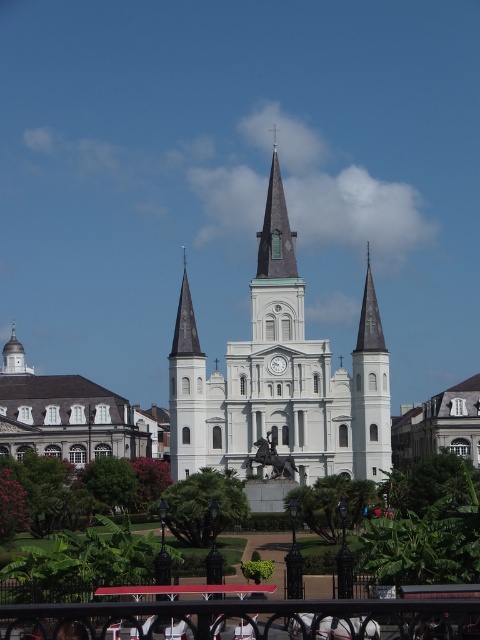
Question: Is white stone clock tower at center below dark gray stone spire at center?

Choices:
 (A) yes
 (B) no

Answer: (A)

Question: Can you confirm if dark gray stone spire at center is thinner than white glossy clock at center?

Choices:
 (A) no
 (B) yes

Answer: (A)

Question: Which point is closer to the camera?

Choices:
 (A) (267, 193)
 (B) (272, 365)

Answer: (B)

Question: Is white stone church at center to the right of dark gray stone spire at center from the viewer's perspective?

Choices:
 (A) yes
 (B) no

Answer: (B)

Question: Which point is closer to the camera?

Choices:
 (A) white stone church at center
 (B) dark gray stone spire at center
 (C) white glossy clock at center

Answer: (C)

Question: Which point is closer to the camera taking this photo?

Choices:
 (A) (268, 234)
 (B) (278, 358)
 (C) (273, 188)
 (D) (60, 444)

Answer: (B)